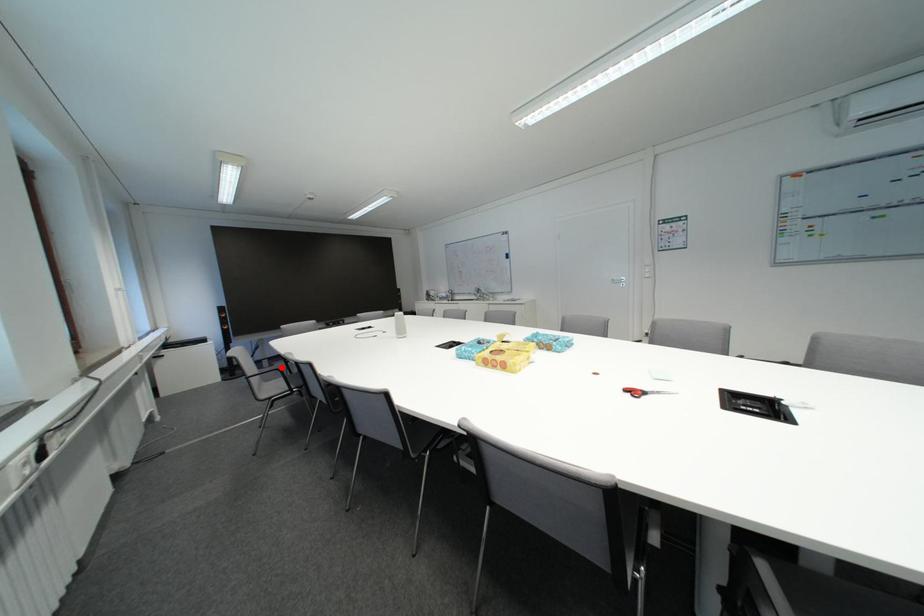
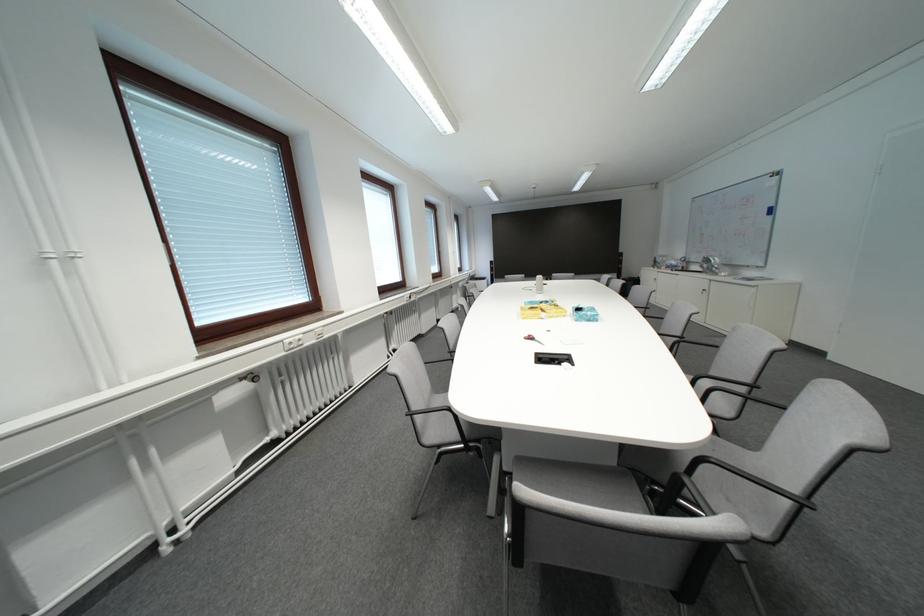
Question: I am providing you with two images of the same scene from different viewpoints. A red point is marked on the first image. At the location where the point appears in image 1, is it still visible in image 2?

Choices:
 (A) Yes
 (B) No

Answer: (B)